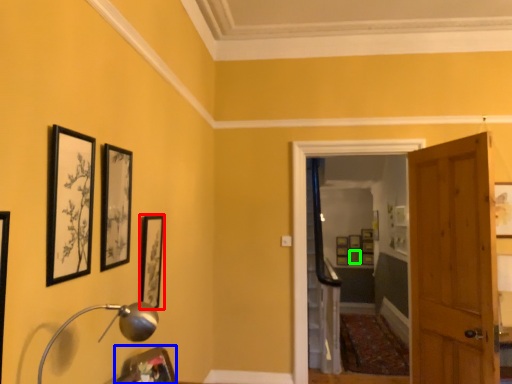
Question: Which object is the farthest from picture frame (highlighted by a red box)? Choose among these: picture frame (highlighted by a blue box) or picture frame (highlighted by a green box).

Choices:
 (A) picture frame
 (B) picture frame

Answer: (B)